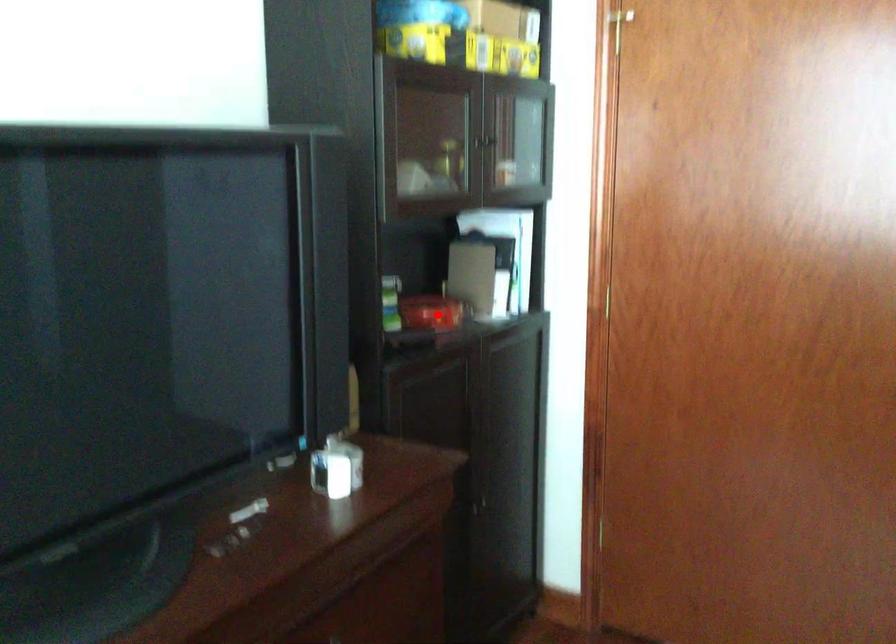
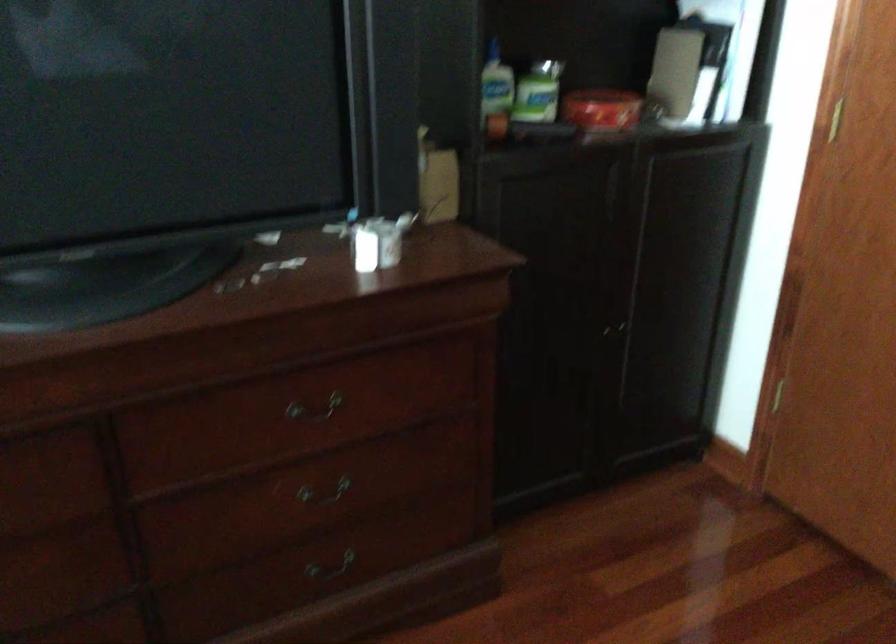
Question: I am providing you with two images of the same scene from different viewpoints. A red point is marked on the first image. At the location where the point appears in image 1, is it still visible in image 2?

Choices:
 (A) Yes
 (B) No

Answer: (A)